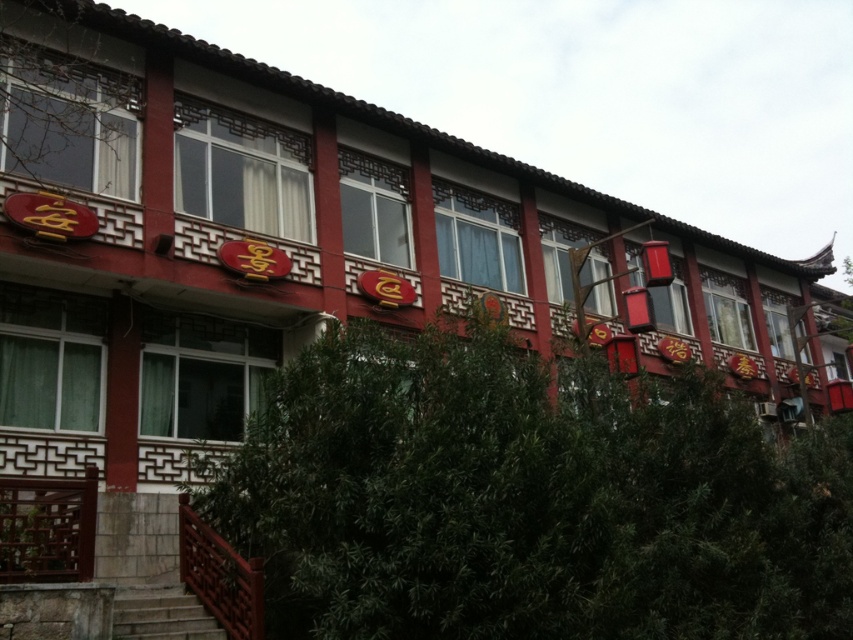
You are standing at the entrance of the traditional East Asian building and want to find a green leafy tree. According to the image, where is the green leafy tree at lower center located in relation to the building?

The green leafy tree at lower center is located at point (x=527, y=499), which is near the bottom right side of the building.

You are standing in front of the traditional East Asian building and want to walk towards the green leafy tree at lower center. Which side of the wooden railing at lower left should you go to reach the tree?

To reach the green leafy tree at lower center, you should go to the right side of the wooden railing at lower left because the tree is positioned to the right of the railing.